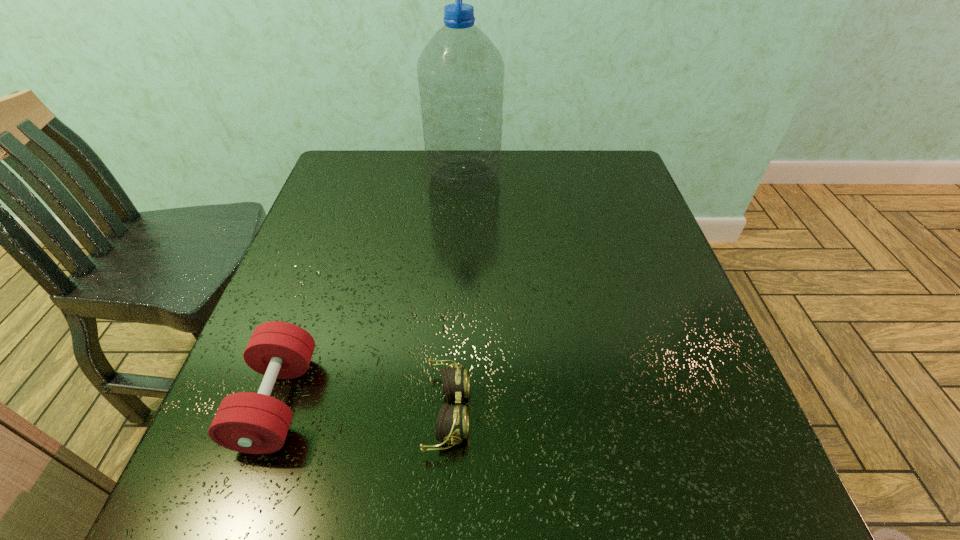
Find the location of a particular element. The height and width of the screenshot is (540, 960). free area in between the second tallest object and the goggles is located at coordinates (363, 407).

Where is `empty space that is in between the leftmost object and the tallest object`? The height and width of the screenshot is (540, 960). empty space that is in between the leftmost object and the tallest object is located at coordinates (371, 288).

Where is `vacant region between the farthest object and the goggles`? vacant region between the farthest object and the goggles is located at coordinates (456, 293).

You are a GUI agent. You are given a task and a screenshot of the screen. Output one action in this format:
    pyautogui.click(x=<x>, y=<y>)
    Task: Click on the vacant space in between the second shortest object and the farthest object
    Image resolution: width=960 pixels, height=540 pixels.
    Given the screenshot: What is the action you would take?
    pyautogui.click(x=371, y=288)

Where is `free point between the shortest object and the leftmost object`? free point between the shortest object and the leftmost object is located at coordinates (363, 407).

Locate an element on the screen. object that can be found as the closest to the second shortest object is located at coordinates (452, 423).

Locate an element on the screen. Image resolution: width=960 pixels, height=540 pixels. object that can be found as the closest to the goggles is located at coordinates (254, 423).

You are a GUI agent. You are given a task and a screenshot of the screen. Output one action in this format:
    pyautogui.click(x=<x>, y=<y>)
    Task: Click on the vacant space that satisfies the following two spatial constraints: 1. on the front side of the tallest object; 2. through the lenses of the goggles
    This screenshot has height=540, width=960.
    Given the screenshot: What is the action you would take?
    pyautogui.click(x=452, y=411)